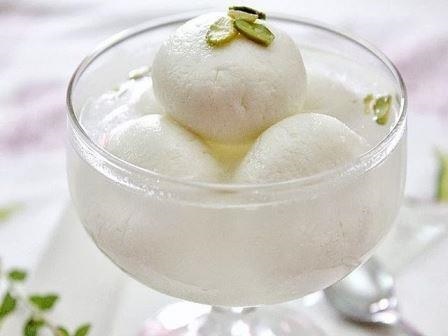
Where is `spoon`? spoon is located at coordinates (386, 314).